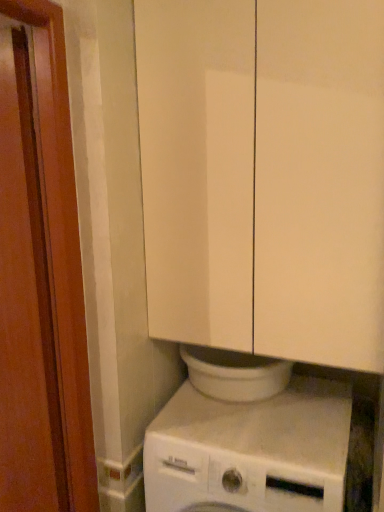
Question: From their relative heights in the image, would you say white glossy cabinet at upper center is taller or shorter than brown wood screen door at left?

Choices:
 (A) tall
 (B) short

Answer: (B)

Question: Considering their positions, is white glossy cabinet at upper center located in front of or behind brown wood screen door at left?

Choices:
 (A) behind
 (B) front

Answer: (A)

Question: Which object is the closest to the white matte washing machine at lower center?

Choices:
 (A) brown wood screen door at left
 (B) white glossy cabinet at upper center

Answer: (A)

Question: Which of these objects is positioned farthest from the white matte washing machine at lower center?

Choices:
 (A) white glossy cabinet at upper center
 (B) brown wood screen door at left

Answer: (A)